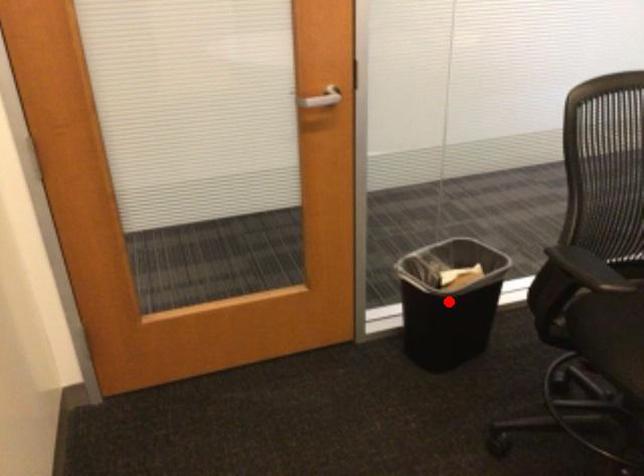
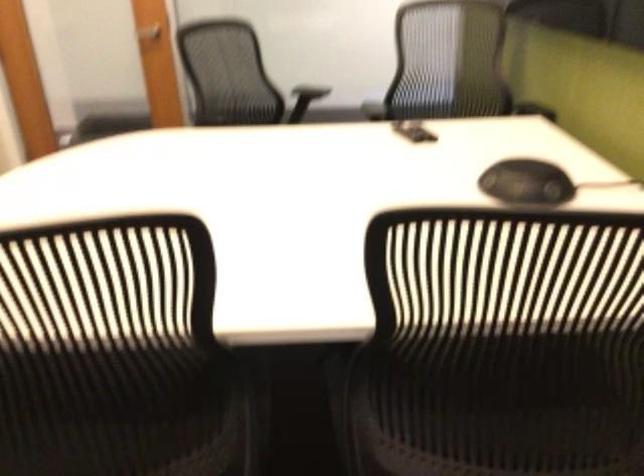
Question: I am providing you with two images of the same scene from different viewpoints. A red point is marked on the first image. Is the red point's position out of view in image 2?

Choices:
 (A) Yes
 (B) No

Answer: (A)